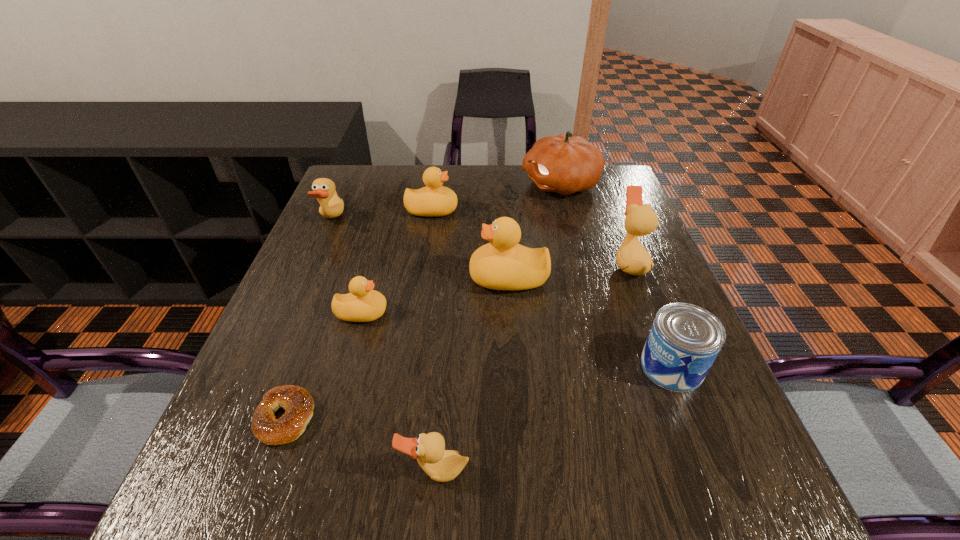
Identify the location of free spot located 0.340m on the face of the rightmost yellow duck. (324, 278).

This screenshot has width=960, height=540. I want to click on blank space located on the beak of the rightmost duck, so click(459, 263).

I want to click on free spot located 0.180m on the beak of the rightmost duck, so click(538, 263).

What are the coordinates of `vacant region located on the beak of the rightmost duck` in the screenshot? It's located at (554, 263).

Locate an element on the screen. free space located 0.330m on the face of the second biggest yellow duck is located at coordinates (576, 211).

Locate an element on the screen. The height and width of the screenshot is (540, 960). vacant space located 0.210m on the beak of the leftmost duck is located at coordinates (420, 220).

The height and width of the screenshot is (540, 960). What are the coordinates of `free region located on the front label of the can` in the screenshot? It's located at (510, 366).

The width and height of the screenshot is (960, 540). In order to click on free space located on the front label of the can in this screenshot , I will do `click(588, 366)`.

Locate an element on the screen. vacant point located 0.200m on the front label of the can is located at coordinates (536, 366).

This screenshot has width=960, height=540. What are the coordinates of `free spot located 0.310m on the face of the fourth nearest object` in the screenshot? It's located at (533, 313).